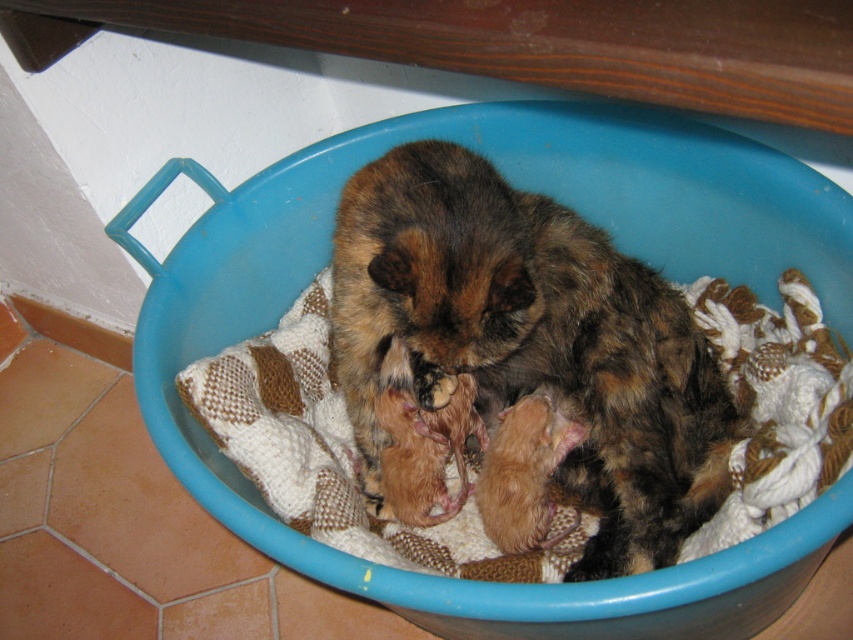
Question: Which point is farther to the camera?

Choices:
 (A) blue plastic bowl at center
 (B) fluffy brown cat at center

Answer: (B)

Question: Does blue plastic bowl at center have a lesser width compared to fluffy brown cat at center?

Choices:
 (A) yes
 (B) no

Answer: (B)

Question: Does blue plastic bowl at center have a lesser width compared to fluffy brown cat at center?

Choices:
 (A) yes
 (B) no

Answer: (B)

Question: Among these objects, which one is nearest to the camera?

Choices:
 (A) fluffy brown cat at center
 (B) blue plastic bowl at center

Answer: (B)

Question: Can you confirm if blue plastic bowl at center is thinner than fluffy brown cat at center?

Choices:
 (A) yes
 (B) no

Answer: (B)